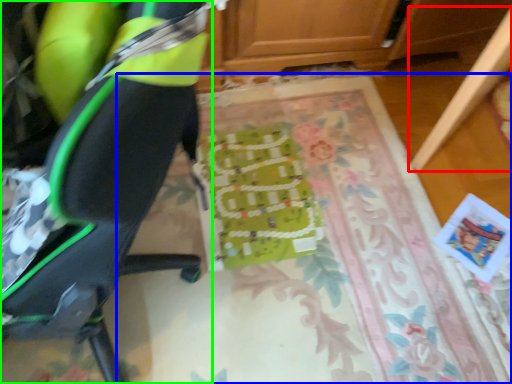
Question: Based on their relative distances, which object is farther from furniture (highlighted by a red box)? Choose from mat (highlighted by a blue box) and chair (highlighted by a green box).

Choices:
 (A) mat
 (B) chair

Answer: (B)